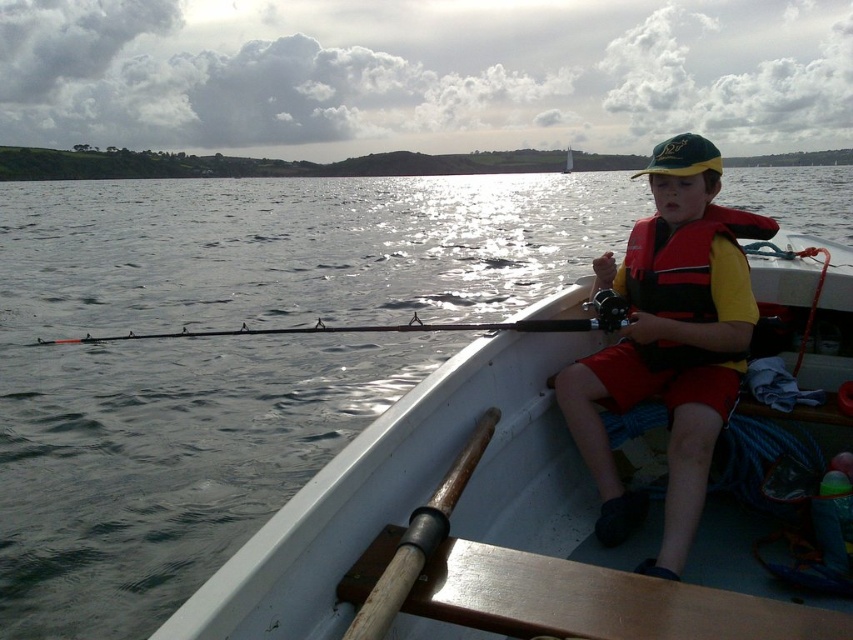
You are a safety inspector checking the boat setup. The white plastic boat at center and the matte orange life vest at center must be arranged properly. According to safety regulations, life vests should be easily accessible and not obstructed by the boat. Is the current arrangement compliant with safety standards?

The white plastic boat at center is in front of the matte orange life vest at center, which means the life vest might be obstructed by the boat, making it less accessible. This arrangement does not comply with safety standards as the life vest should be easily reachable without obstruction.

You are a safety inspector checking the boat for proper equipment. You notice the matte orange life vest at center and the red nylon life jacket at center. According to regulations, life vests must be easily accessible and not stored under other items. Is the current arrangement compliant?

The matte orange life vest at center is positioned under the red nylon life jacket at center, which violates the regulation requiring life vests to be easily accessible and not stored under other items. The arrangement is not compliant.